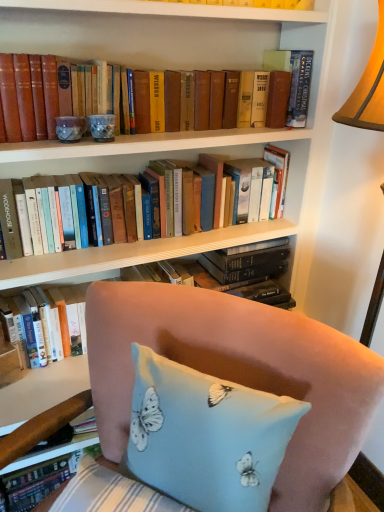
Question: From the image's perspective, is light blue fabric pillow with butterfly print at lower center on top of hardcover book at upper right, the 3th book ordered from the bottom?

Choices:
 (A) no
 (B) yes

Answer: (A)

Question: From a real-world perspective, is light blue fabric pillow with butterfly print at lower center on hardcover book at upper right, acting as the 1th book starting from the top?

Choices:
 (A) no
 (B) yes

Answer: (A)

Question: Are light blue fabric pillow with butterfly print at lower center and hardcover book at upper right, the 3th book ordered from the bottom, located far from each other?

Choices:
 (A) yes
 (B) no

Answer: (B)

Question: Is light blue fabric pillow with butterfly print at lower center placed right next to hardcover book at upper right, the 3th book ordered from the bottom?

Choices:
 (A) yes
 (B) no

Answer: (B)

Question: Is light blue fabric pillow with butterfly print at lower center completely or partially outside of hardcover book at upper right, the 3th book ordered from the bottom?

Choices:
 (A) yes
 (B) no

Answer: (A)

Question: From a real-world perspective, is matte brown book at upper center, marked as the second book in a bottom-to-top arrangement, above or below light blue fabric pillow with butterfly print at lower center?

Choices:
 (A) above
 (B) below

Answer: (A)

Question: Is matte brown book at upper center, the 2th book positioned from the top, spatially inside light blue fabric pillow with butterfly print at lower center, or outside of it?

Choices:
 (A) outside
 (B) inside

Answer: (A)

Question: Is point (46, 132) closer or farther from the camera than point (266, 401)?

Choices:
 (A) closer
 (B) farther

Answer: (B)

Question: Is matte brown book at upper center, marked as the second book in a bottom-to-top arrangement, in front of or behind light blue fabric pillow with butterfly print at lower center in the image?

Choices:
 (A) front
 (B) behind

Answer: (B)

Question: Considering the positions of point (284, 88) and point (26, 188), is point (284, 88) closer or farther from the camera than point (26, 188)?

Choices:
 (A) farther
 (B) closer

Answer: (A)

Question: From a real-world perspective, is matte brown book at upper center, the 2th book positioned from the top, above or below hardcover books at center, which is the 1th book in bottom-to-top order?

Choices:
 (A) below
 (B) above

Answer: (B)

Question: In terms of width, does matte brown book at upper center, marked as the second book in a bottom-to-top arrangement, look wider or thinner when compared to hardcover books at center, which is the 1th book in bottom-to-top order?

Choices:
 (A) wide
 (B) thin

Answer: (B)

Question: Looking at the image, does matte brown book at upper center, marked as the second book in a bottom-to-top arrangement, seem bigger or smaller compared to hardcover books at center, which is the 1th book in bottom-to-top order?

Choices:
 (A) big
 (B) small

Answer: (B)

Question: Is point (286, 70) closer or farther from the camera than point (375, 291)?

Choices:
 (A) farther
 (B) closer

Answer: (A)

Question: Is hardcover book at upper right, the 3th book ordered from the bottom, to the left or to the right of pink fabric chair at lower right in the image?

Choices:
 (A) right
 (B) left

Answer: (A)